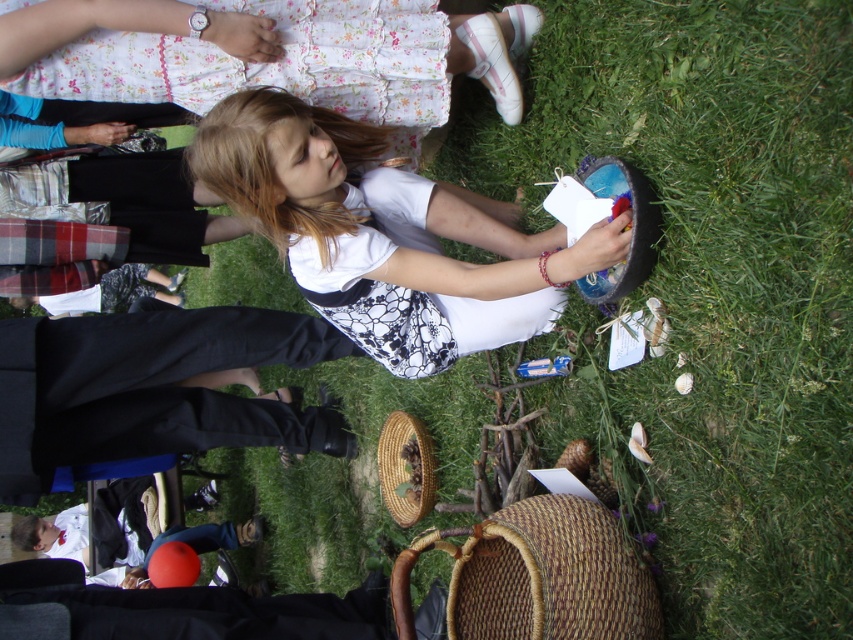
You are a photographer trying to capture a closeup of the white lace dress at center and the black fabric pants at lower left in the image. The camera has a maximum focus range of 70 centimeters. Can you capture both items in focus without moving the camera or the subjects?

The white lace dress at center is 69.93 centimeters away from the black fabric pants at lower left. Since the distance between them is just under 70 centimeters, the camera can focus on both items within its maximum range.